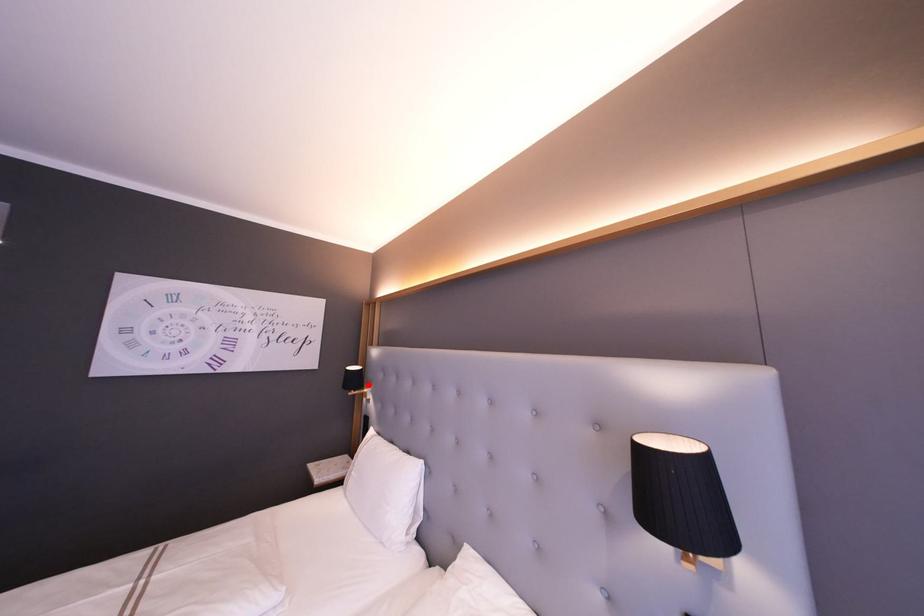
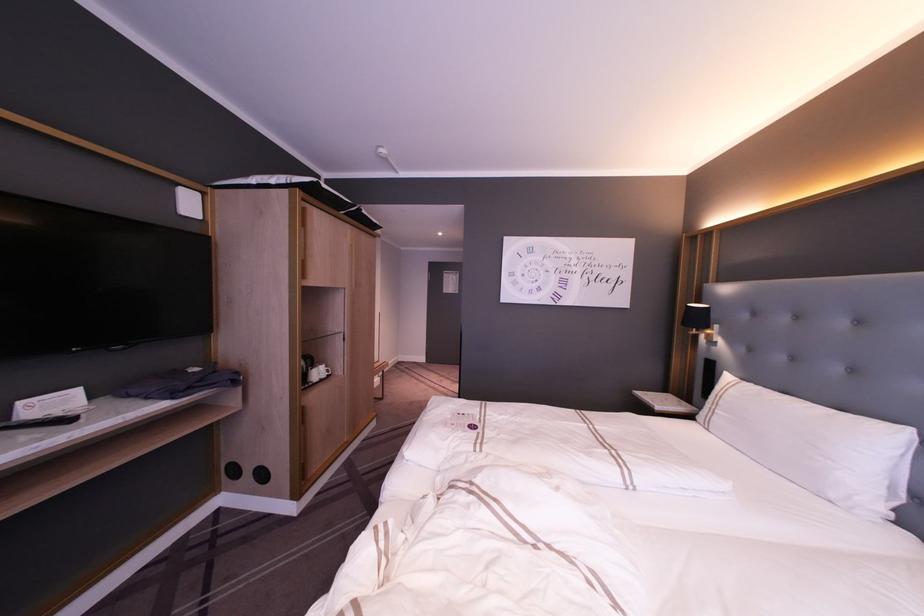
Find the pixel in the second image that matches the highlighted location in the first image.

(715, 326)